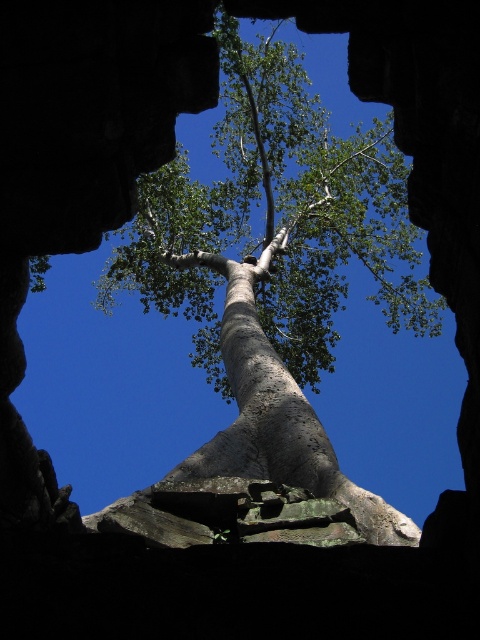
Does smooth bark tree at center have a smaller size compared to smooth gray tree trunk at center?

Actually, smooth bark tree at center might be larger than smooth gray tree trunk at center.

Which is in front, point (255, 189) or point (255, 417)?

Point (255, 417) is in front.

The image size is (480, 640). In order to click on smooth bark tree at center in this screenshot , I will do `click(276, 272)`.